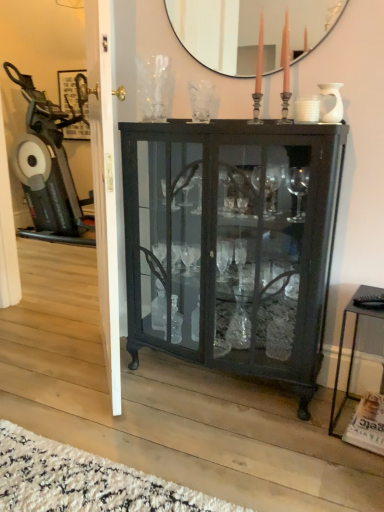
I want to click on free space between black metal side table at lower right and matte black cabinet at center, so click(x=306, y=410).